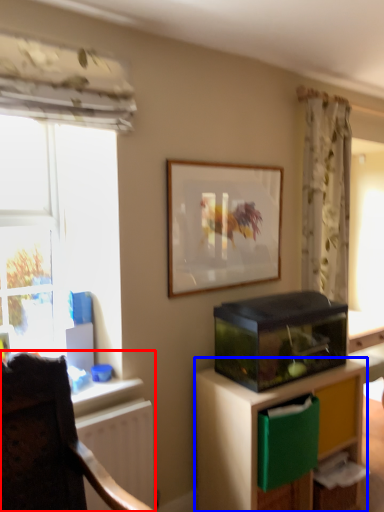
Question: Which object is further to the camera taking this photo, chair (highlighted by a red box) or cabinetry (highlighted by a blue box)?

Choices:
 (A) chair
 (B) cabinetry

Answer: (B)